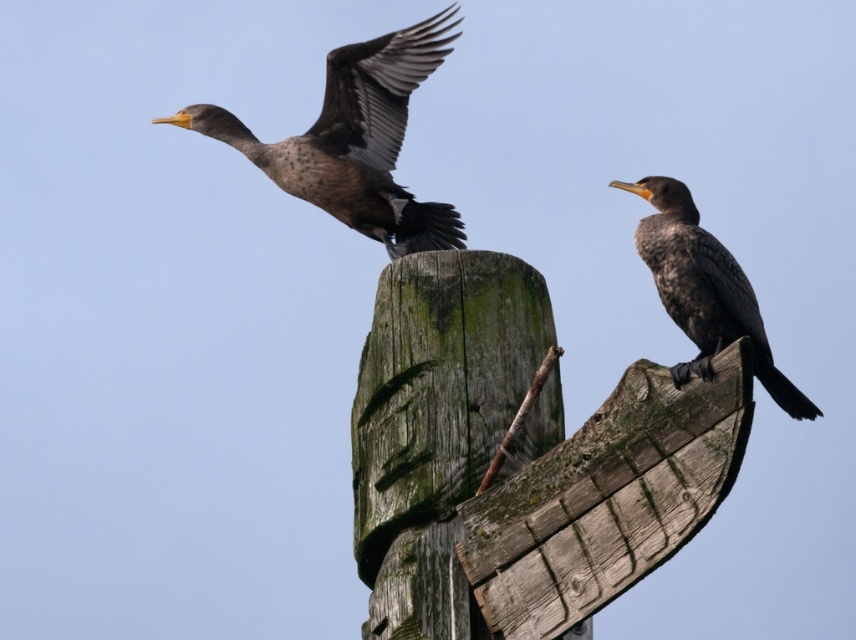
Question: Does brown speckled feathers at upper left have a larger size compared to dark brown feathers at center?

Choices:
 (A) yes
 (B) no

Answer: (A)

Question: Among these objects, which one is farthest from the camera?

Choices:
 (A) dark brown feathers at center
 (B) brown speckled feathers at upper left

Answer: (B)

Question: Can you confirm if brown speckled feathers at upper left is bigger than dark brown feathers at center?

Choices:
 (A) no
 (B) yes

Answer: (B)

Question: Can you confirm if brown speckled feathers at upper left is thinner than dark brown feathers at center?

Choices:
 (A) yes
 (B) no

Answer: (B)